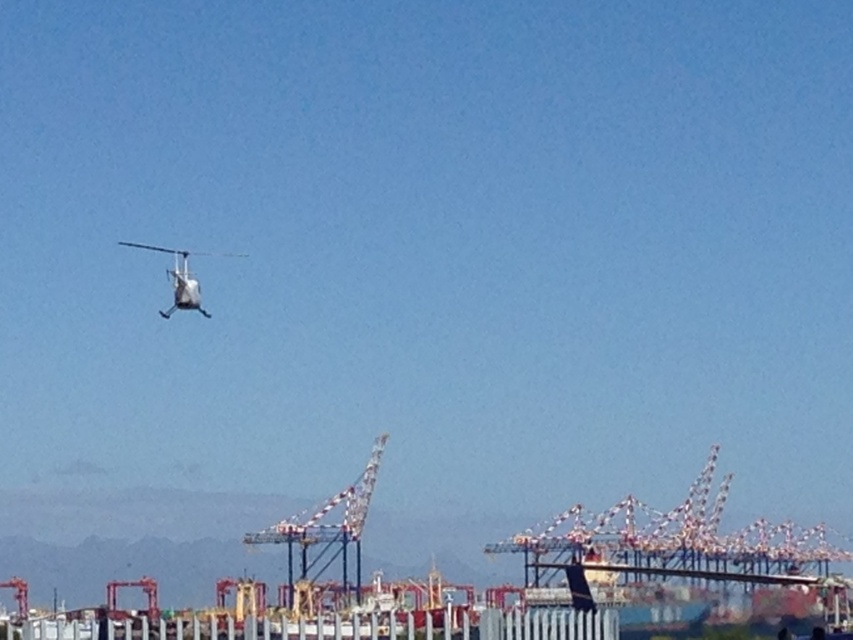
From the picture: Measure the distance between point (312,532) and camera.

Point (312,532) is 342.11 meters away from camera.

Which is above, white painted metal crane at center or white matte helicopter at upper left?

white matte helicopter at upper left

At what (x,y) coordinates should I click in order to perform the action: click on white painted metal crane at center. Please return your answer as a coordinate pair (x, y). Image resolution: width=853 pixels, height=640 pixels. Looking at the image, I should click on coord(325,534).

Locate an element on the screen. The image size is (853, 640). white painted metal crane at center is located at coordinates (325, 534).